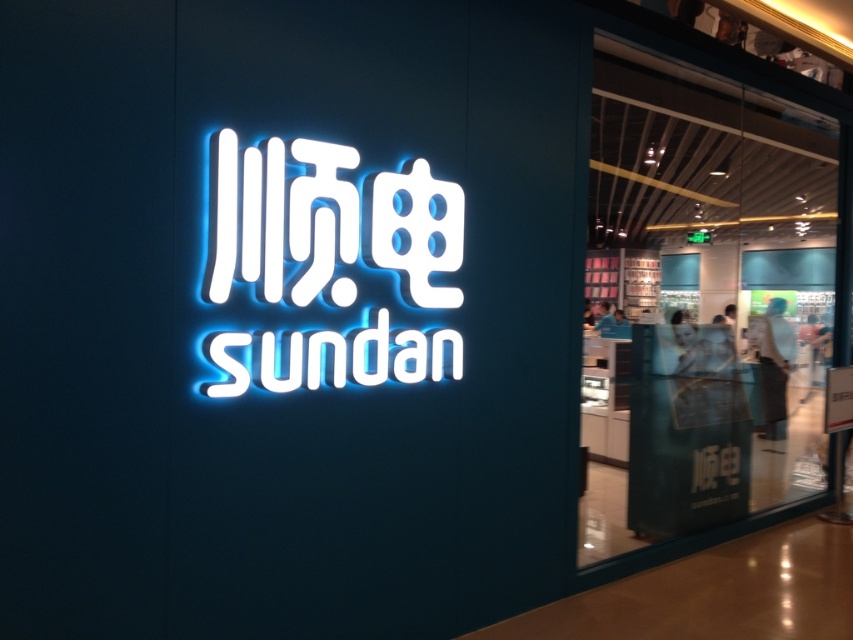
From the picture: You are standing in front of the store and want to take a photo of the white glossy sign at center. If your camera can focus on objects up to 3.5 meters away, will it be able to capture the sign clearly?

The white glossy sign at center is 4.00 meters away from the camera, which exceeds the camera focus limit of 3.5 meters. Therefore, the camera cannot capture the sign clearly.

You are a customer standing in front of the store and want to read both the white glossy sign at center and the neon white sign at center. Which sign do you think you can read more clearly?

The white glossy sign at center has a greater width than the neon white sign at center, so it can be read more clearly.

You are standing in front of the store and want to locate the white glossy sign at center. What are the coordinates where you should look?

The white glossy sign at center is located at coordinates point (701, 300).